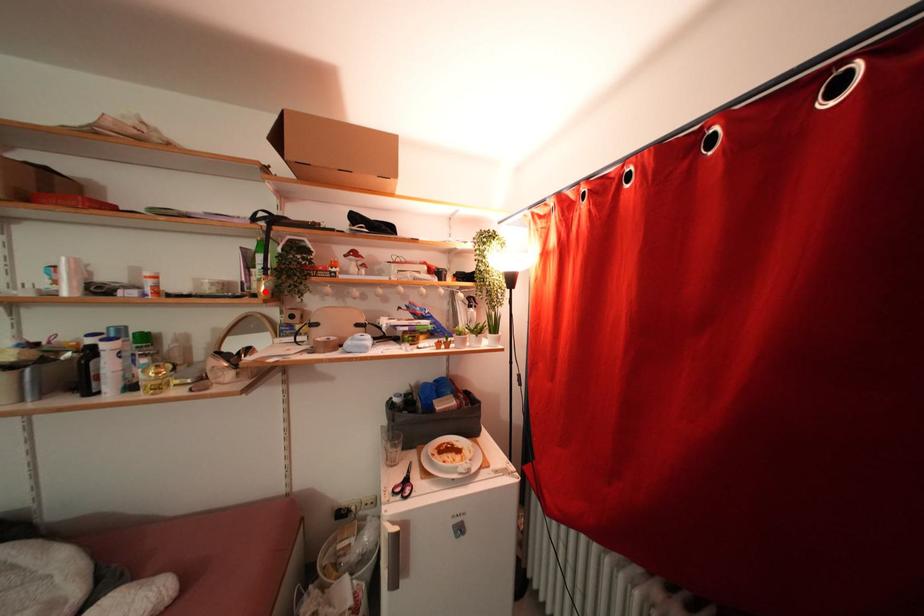
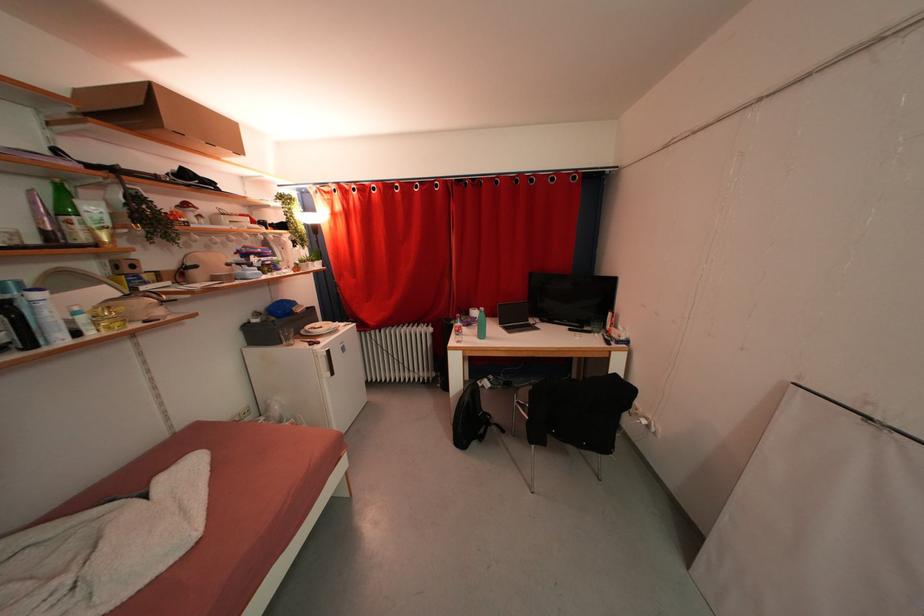
The point at the highlighted location is marked in the first image. Where is the corresponding point in the second image?

(102, 241)